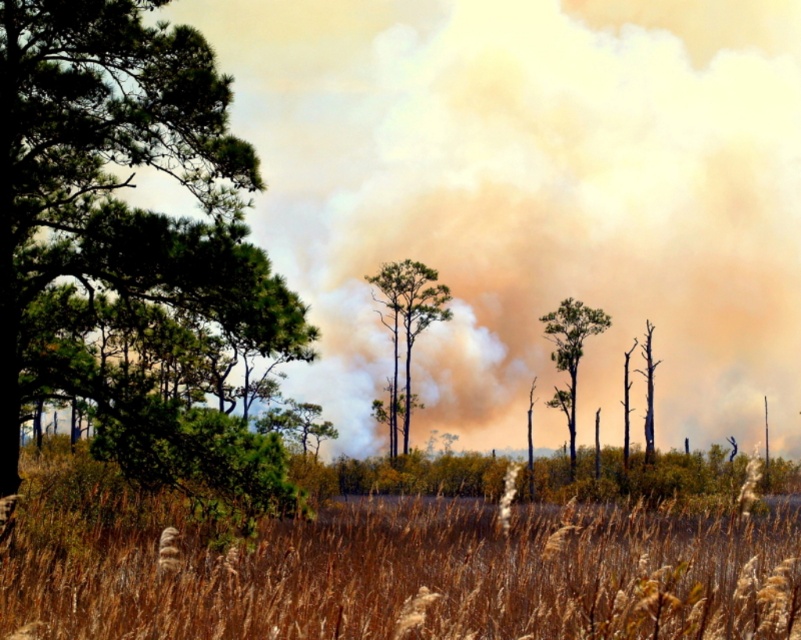
You are a firefighter trying to assess the fire spread in the scene. You see a point at coordinates point (409,576). What is located at this point?

The point (409,576) corresponds to brown dry grass at center.

You are a firefighter assessing the scene. You see the brown dry grass at center and the charred wood tree at center. Which object is closer to you?

The brown dry grass at center is closer to you because it is positioned in front of the charred wood tree at center.

You are a firefighter assessing the wildfire scene. You notice a green matte tree at left and brown dry grass at center. Which object is positioned higher in the image?

The green matte tree at left is located above the brown dry grass at center, so it is positioned higher in the image.